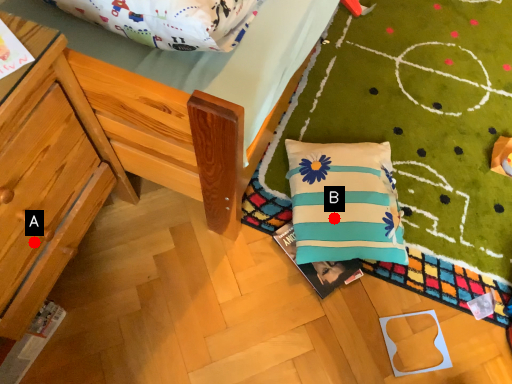
Question: Two points are circled on the image, labeled by A and B beside each circle. Which of the following is the farthest from the observer?

Choices:
 (A) A is further
 (B) B is further

Answer: (B)